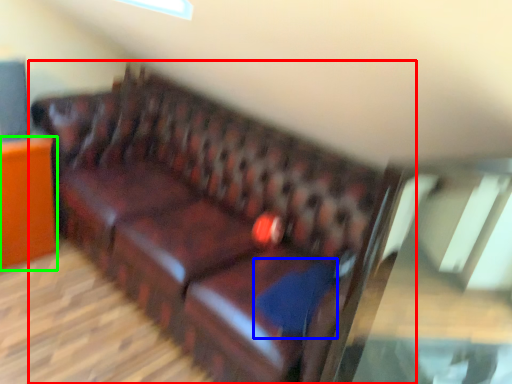
Question: Considering the real-world distances, which object is closest to studio couch (highlighted by a red box)? pillow (highlighted by a blue box) or furniture (highlighted by a green box).

Choices:
 (A) pillow
 (B) furniture

Answer: (A)